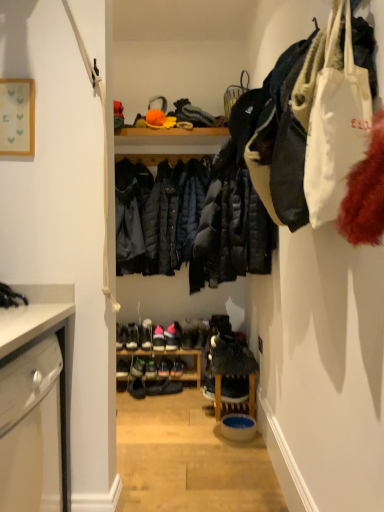
This screenshot has width=384, height=512. I want to click on shiny black sneakers at center, the sixth footwear positioned from the left, so click(172, 337).

What is the approximate height of shiny black shoe at center, positioned as the seventh footwear in right-to-left order?

4.29 inches.

In order to face pink suede shoes at center, marked as the 8th footwear in a right-to-left arrangement, should I rotate leftwards or rightwards?

To face it directly, rotate left by 6.121 degrees.

This screenshot has width=384, height=512. What do you see at coordinates (146, 334) in the screenshot? I see `pink suede shoes at center, which appears as the 1th footwear when viewed from the left` at bounding box center [146, 334].

This screenshot has width=384, height=512. Describe the element at coordinates (234, 389) in the screenshot. I see `white suede sneakers at center, the eighth footwear when ordered from left to right` at that location.

Measure the distance between point (x=145, y=388) and camera.

The distance of point (x=145, y=388) from camera is 3.07 meters.

What do you see at coordinates (163, 387) in the screenshot? The width and height of the screenshot is (384, 512). I see `black leather shoes at center, the fifth footwear in the right-to-left sequence` at bounding box center [163, 387].

You are a GUI agent. You are given a task and a screenshot of the screen. Output one action in this format:
    pyautogui.click(x=<x>, y=<y>)
    Task: Click on the shiny black shoe at center, the 5th footwear positioned from the left
    
    Given the screenshot: What is the action you would take?
    pyautogui.click(x=164, y=367)

The height and width of the screenshot is (512, 384). Find the location of `shiny black shoe at center, the 7th footwear when ordered from left to right`. shiny black shoe at center, the 7th footwear when ordered from left to right is located at coordinates (177, 368).

Based on the photo, can you see shiny black shoe at center, positioned as the seventh footwear in right-to-left order, touching shiny black sneakers at center, the 3th footwear positioned from the right?

No, shiny black shoe at center, positioned as the seventh footwear in right-to-left order, is not touching shiny black sneakers at center, the 3th footwear positioned from the right.

From a real-world perspective, which object rests below the other?

shiny black shoe at center, positioned as the seventh footwear in right-to-left order, from a real-world perspective.

Considering the sizes of objects shiny black shoe at center, positioned as the seventh footwear in right-to-left order, and shiny black sneakers at center, the sixth footwear positioned from the left, in the image provided, who is thinner, shiny black shoe at center, positioned as the seventh footwear in right-to-left order, or shiny black sneakers at center, the sixth footwear positioned from the left,?

With smaller width is shiny black shoe at center, positioned as the seventh footwear in right-to-left order.

In the scene shown: Which is more to the right, shiny black shoe at center, the 7th footwear when ordered from left to right, or shiny black shoe at center, the 5th footwear positioned from the left?

From the viewer's perspective, shiny black shoe at center, the 7th footwear when ordered from left to right, appears more on the right side.

Which is in front, shiny black shoe at center, the 7th footwear when ordered from left to right, or shiny black shoe at center, the 5th footwear positioned from the left?

Positioned in front is shiny black shoe at center, the 5th footwear positioned from the left.

Considering the points (173, 372) and (168, 368), which point is behind, point (173, 372) or point (168, 368)?

The point (168, 368) is more distant.

From the image's perspective, would you say shiny black shoe at center, which is the 2th footwear from left to right, is shown under shiny black shoe at center, which appears as the fourth footwear when viewed from the right?

Yes, from the image's perspective, shiny black shoe at center, which is the 2th footwear from left to right, is below shiny black shoe at center, which appears as the fourth footwear when viewed from the right.

Is shiny black shoe at center, positioned as the seventh footwear in right-to-left order, oriented away from shiny black shoe at center, which appears as the fourth footwear when viewed from the right?

No, shiny black shoe at center, positioned as the seventh footwear in right-to-left order,'s orientation is not away from shiny black shoe at center, which appears as the fourth footwear when viewed from the right.

Does point (148, 377) appear closer or farther from the camera than point (160, 370)?

Clearly, point (148, 377) is closer to the camera than point (160, 370).

How far apart are shiny black shoe at center, positioned as the seventh footwear in right-to-left order, and shiny black shoe at center, which appears as the fourth footwear when viewed from the right?

The distance of shiny black shoe at center, positioned as the seventh footwear in right-to-left order, from shiny black shoe at center, which appears as the fourth footwear when viewed from the right, is 5.93 centimeters.

Can you confirm if shiny black sneakers at center, the sixth footwear positioned from the left, is bigger than pink suede shoes at center, which appears as the 1th footwear when viewed from the left?

Yes, shiny black sneakers at center, the sixth footwear positioned from the left, is bigger than pink suede shoes at center, which appears as the 1th footwear when viewed from the left.

Which is behind, point (165, 343) or point (148, 325)?

The point (148, 325) is behind.

Choose the correct answer: Is shiny black sneakers at center, the sixth footwear positioned from the left, inside pink suede shoes at center, marked as the 8th footwear in a right-to-left arrangement, or outside it?

The correct answer is: outside.

From a real-world perspective, which object stands above the other?

From a 3D spatial view, pink suede shoes at center, which appears as the 1th footwear when viewed from the left, is above.

Who is taller, shiny black shoe at center, the 7th footwear when ordered from left to right, or shiny black sneakers at center, the sixth footwear positioned from the left?

shiny black shoe at center, the 7th footwear when ordered from left to right, is taller.

Considering the sizes of objects shiny black shoe at center, acting as the 2th footwear starting from the right, and shiny black sneakers at center, the 3th footwear positioned from the right, in the image provided, who is thinner, shiny black shoe at center, acting as the 2th footwear starting from the right, or shiny black sneakers at center, the 3th footwear positioned from the right,?

Thinner between the two is shiny black sneakers at center, the 3th footwear positioned from the right.

Does shiny black shoe at center, acting as the 2th footwear starting from the right, turn towards shiny black sneakers at center, the sixth footwear positioned from the left?

No, shiny black shoe at center, acting as the 2th footwear starting from the right, is not turned towards shiny black sneakers at center, the sixth footwear positioned from the left.

The image size is (384, 512). What are the coordinates of `footwear that is the 2nd object located behind the shiny black sneakers at center, the 3th footwear positioned from the right` in the screenshot? It's located at (177, 368).

Is black leather shoes at center, acting as the fourth footwear starting from the left, oriented towards shiny black shoe at center, the 5th footwear positioned from the left?

No.

Is point (165, 382) closer to camera compared to point (168, 375)?

Yes.

Which of these two, black leather shoes at center, the fifth footwear in the right-to-left sequence, or shiny black shoe at center, which appears as the fourth footwear when viewed from the right, stands taller?

black leather shoes at center, the fifth footwear in the right-to-left sequence, is taller.

Which object is further away from the camera, black leather shoes at center, the fifth footwear in the right-to-left sequence, or shiny black shoe at center, the 5th footwear positioned from the left?

shiny black shoe at center, the 5th footwear positioned from the left, is further away from the camera.

Looking at their sizes, would you say shiny black sneakers at center, the sixth footwear positioned from the left, is wider or thinner than shiny black shoe at center, which is the 2th footwear from left to right?

In the image, shiny black sneakers at center, the sixth footwear positioned from the left, appears to be wider than shiny black shoe at center, which is the 2th footwear from left to right.

Is shiny black sneakers at center, the 3th footwear positioned from the right, in front of or behind shiny black shoe at center, positioned as the seventh footwear in right-to-left order, in the image?

In the image, shiny black sneakers at center, the 3th footwear positioned from the right, appears behind shiny black shoe at center, positioned as the seventh footwear in right-to-left order.

Which is less distant, (172, 325) or (147, 377)?

Point (172, 325) appears to be farther away from the viewer than point (147, 377).

You are a GUI agent. You are given a task and a screenshot of the screen. Output one action in this format:
    pyautogui.click(x=<x>, y=<y>)
    Task: Click on the 3rd footwear positioned above the shiny black shoe at center, which is the 2th footwear from left to right (from a real-world perspective)
    This screenshot has width=384, height=512.
    Given the screenshot: What is the action you would take?
    pyautogui.click(x=172, y=337)

Which footwear is the 4th one when counting from the front of the shiny black shoe at center, the 7th footwear when ordered from left to right? Please provide its 2D coordinates.

[(164, 367)]

Considering their positions, is pink suede shoes at center, which appears as the 1th footwear when viewed from the left, positioned further to shiny black sneakers at center, the sixth footwear positioned from the left, than shiny black shoe at center, which appears as the fourth footwear when viewed from the right?

Among the two, shiny black shoe at center, which appears as the fourth footwear when viewed from the right, is located further to shiny black sneakers at center, the sixth footwear positioned from the left.

When comparing their distances from shiny black shoe at center, the 5th footwear positioned from the left, does pink suede shoes at center, marked as the 8th footwear in a right-to-left arrangement, or shiny black shoe at center, acting as the 2th footwear starting from the right, seem further?

The object further to shiny black shoe at center, the 5th footwear positioned from the left, is pink suede shoes at center, marked as the 8th footwear in a right-to-left arrangement.

Considering their positions, is shiny black shoe at center, which is the 2th footwear from left to right, positioned closer to shiny black shoe at center, which appears as the fourth footwear when viewed from the right, than white suede sneakers at center, which is the 1th footwear in right-to-left order?

Among the two, shiny black shoe at center, which is the 2th footwear from left to right, is located nearer to shiny black shoe at center, which appears as the fourth footwear when viewed from the right.

When comparing their distances from pink suede shoes at center, which appears as the 1th footwear when viewed from the left, does white suede sneakers at center, the eighth footwear when ordered from left to right, or shiny black shoe at center, which is the 2th footwear from left to right, seem further?

The object further to pink suede shoes at center, which appears as the 1th footwear when viewed from the left, is white suede sneakers at center, the eighth footwear when ordered from left to right.

From the image, which object appears to be farther from pink suede shoes at center, which appears as the 1th footwear when viewed from the left, shiny black shoe at center, which appears as the fourth footwear when viewed from the right, or black leather shoes at center, the fifth footwear in the right-to-left sequence?

black leather shoes at center, the fifth footwear in the right-to-left sequence, is further to pink suede shoes at center, which appears as the 1th footwear when viewed from the left.

Estimate the real-world distances between objects in this image. Which object is closer to black leather shoes at center, acting as the fourth footwear starting from the left, shiny black sneakers at center, the 3th footwear positioned from the right, or shiny black shoe at center, the 5th footwear positioned from the left?

shiny black shoe at center, the 5th footwear positioned from the left, lies closer to black leather shoes at center, acting as the fourth footwear starting from the left, than the other object.

Estimate the real-world distances between objects in this image. Which object is closer to shiny black shoe at center, positioned as the seventh footwear in right-to-left order, shiny black shoe at center, the 7th footwear when ordered from left to right, or shiny black sneakers at center, the sixth footwear positioned from the left?

Answer: shiny black shoe at center, the 7th footwear when ordered from left to right, is positioned closer to the anchor shiny black shoe at center, positioned as the seventh footwear in right-to-left order.

Which object lies nearer to the anchor point matte black shoe at center, which ranks as the 3th footwear in left-to-right order, shiny black sneakers at center, the sixth footwear positioned from the left, or shiny black shoe at center, which is the 2th footwear from left to right?

shiny black sneakers at center, the sixth footwear positioned from the left.

At what (x,y) coordinates should I click in order to perform the action: click on footwear between shiny black sneakers at center, the 3th footwear positioned from the right, and shiny black shoe at center, the 5th footwear positioned from the left, in the up-down direction. Please return your answer as a coordinate pair (x, y). This screenshot has width=384, height=512. Looking at the image, I should click on pyautogui.click(x=177, y=368).

I want to click on footwear that lies between matte black shoe at center, which ranks as the 3th footwear in left-to-right order, and shiny black shoe at center, acting as the 2th footwear starting from the right, from top to bottom, so click(172, 337).